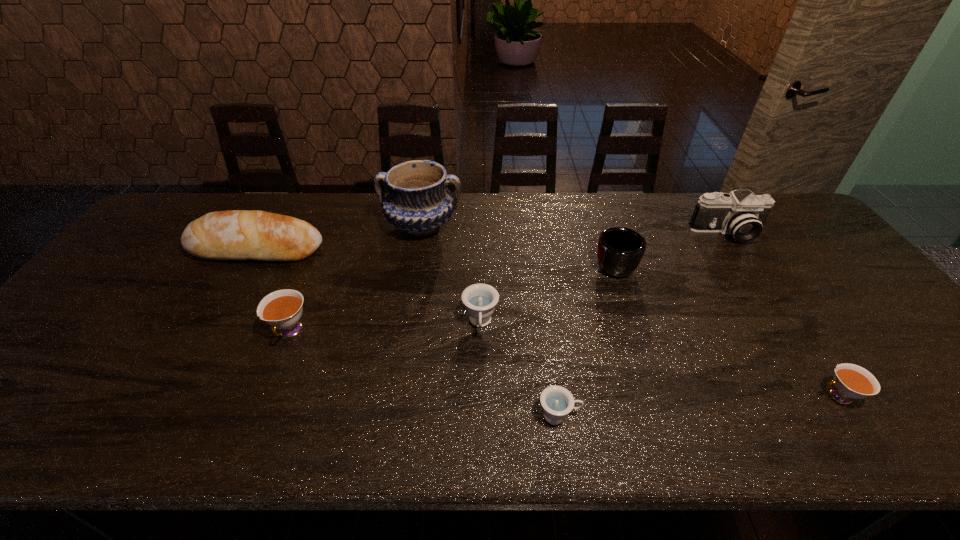
This screenshot has width=960, height=540. I want to click on the fourth object from left to right, so click(480, 300).

You are a GUI agent. You are given a task and a screenshot of the screen. Output one action in this format:
    pyautogui.click(x=<x>, y=<y>)
    Task: Click on the nearer white teacup
    
    Given the screenshot: What is the action you would take?
    pyautogui.click(x=851, y=381)

Locate an element on the screen. the smaller white teacup is located at coordinates (851, 381).

Where is `the second teacup from right to left`? the second teacup from right to left is located at coordinates (557, 402).

The height and width of the screenshot is (540, 960). What are the coordinates of `the fourth object from right to left` in the screenshot? It's located at (557, 402).

What are the coordinates of `vacant space located on the left of the blue pottery` in the screenshot? It's located at (337, 226).

Locate an element on the screen. Image resolution: width=960 pixels, height=540 pixels. vacant space situated on the front of the black camera is located at coordinates (797, 337).

This screenshot has width=960, height=540. Identify the location of free spot located 0.090m on the left of the third tallest object. (160, 248).

I want to click on vacant space located 0.120m on the side of the sixth object from left to right with the handle, so click(x=600, y=221).

I want to click on free space located 0.110m on the side of the sixth object from left to right with the handle, so click(x=600, y=223).